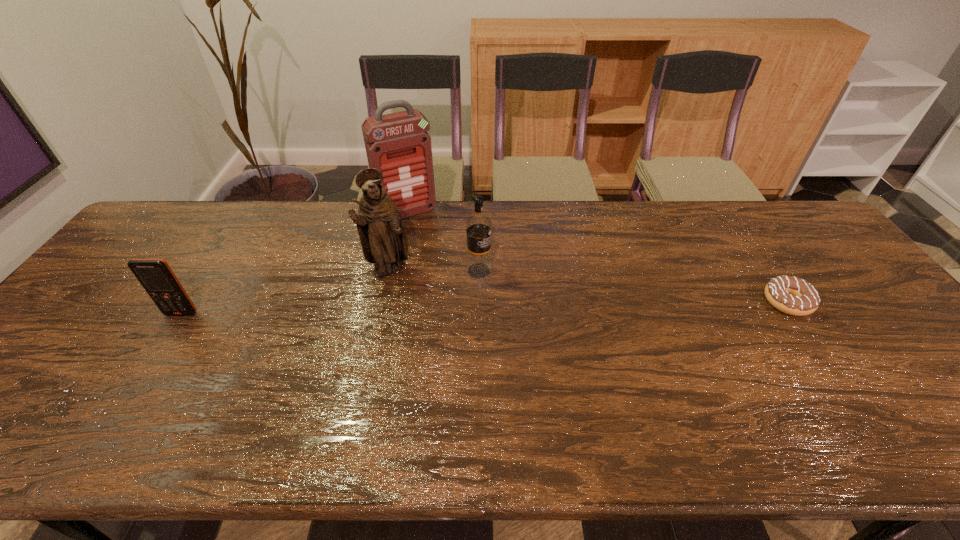
Identify the location of vacant spot on the desktop that is between the cellular telephone and the rightmost object and is positioned on the front-facing side of the second tallest object. (428, 309).

Where is `vacant space on the desktop that is between the leftmost object and the rightmost object and is positioned on the label of the vodka`? vacant space on the desktop that is between the leftmost object and the rightmost object and is positioned on the label of the vodka is located at coordinates (554, 306).

Find the location of a particular element. This screenshot has height=540, width=960. free spot on the desktop that is between the cellular telephone and the doughnut and is positioned on the front-facing side of the farthest object is located at coordinates pos(466,308).